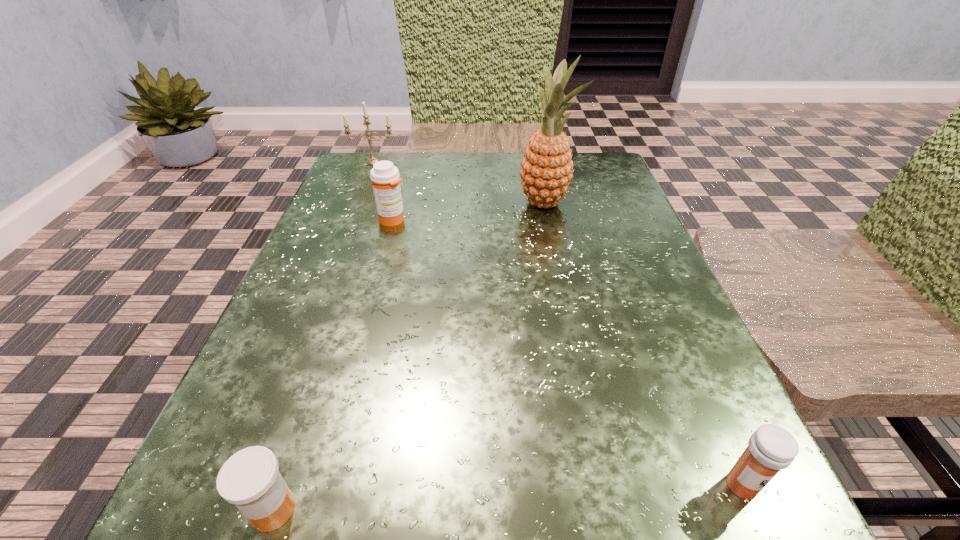
Locate an element on the screen. This screenshot has width=960, height=540. pineapple that is at the far edge is located at coordinates (546, 171).

Identify the location of candle that is at the far edge. (372, 159).

Locate an element on the screen. The height and width of the screenshot is (540, 960). candle present at the left edge is located at coordinates (372, 159).

The height and width of the screenshot is (540, 960). Find the location of `pineapple positioned at the right edge`. pineapple positioned at the right edge is located at coordinates (546, 171).

You are a GUI agent. You are given a task and a screenshot of the screen. Output one action in this format:
    pyautogui.click(x=<x>, y=<y>)
    Task: Click on the medicine at the right edge
    This screenshot has height=540, width=960.
    Given the screenshot: What is the action you would take?
    pyautogui.click(x=771, y=448)

Locate an element on the screen. This screenshot has width=960, height=540. object that is at the far left corner is located at coordinates (372, 159).

This screenshot has width=960, height=540. I want to click on object situated at the near left corner, so click(x=250, y=479).

This screenshot has width=960, height=540. What are the coordinates of `object positioned at the far right corner` in the screenshot? It's located at (546, 171).

Locate an element on the screen. This screenshot has width=960, height=540. object that is at the near right corner is located at coordinates (771, 448).

Locate an element on the screen. The height and width of the screenshot is (540, 960). free region at the far edge of the desktop is located at coordinates (509, 186).